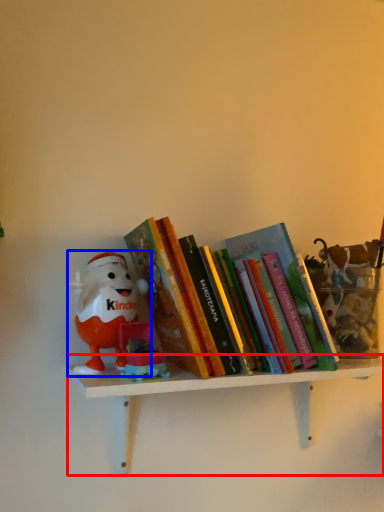
Question: Among these objects, which one is farthest to the camera, shelf (highlighted by a red box) or toy (highlighted by a blue box)?

Choices:
 (A) shelf
 (B) toy

Answer: (B)